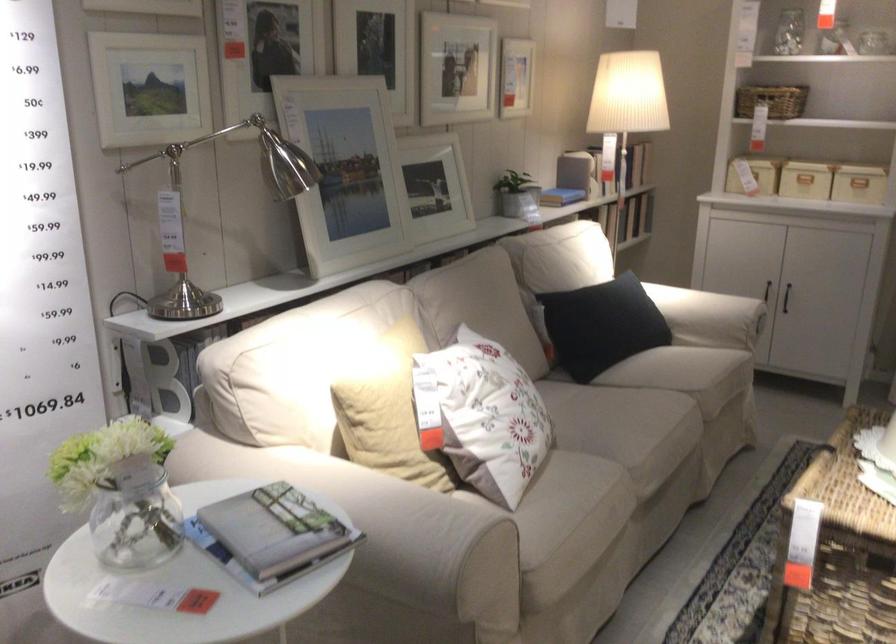
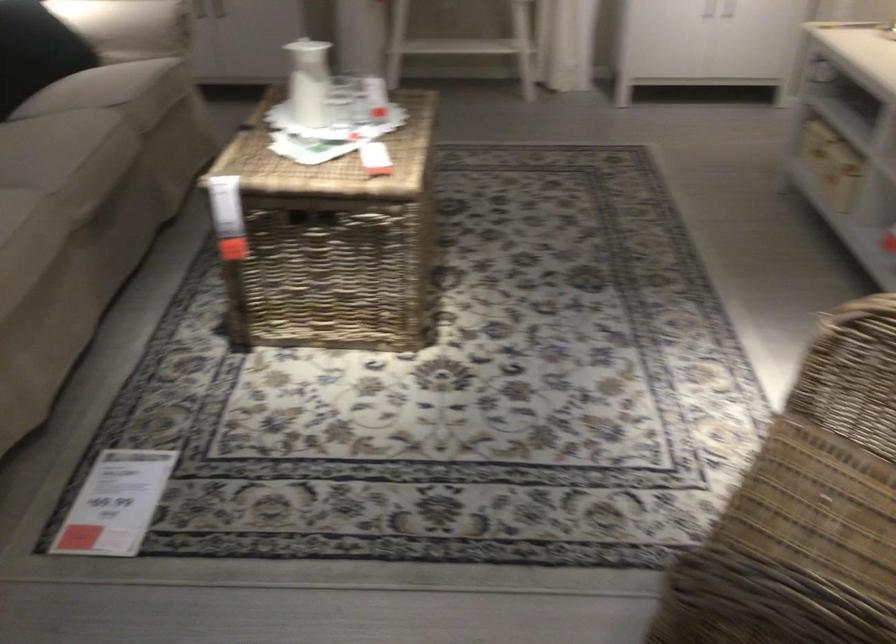
How did the camera likely rotate?

The camera's rotation is toward right-down.